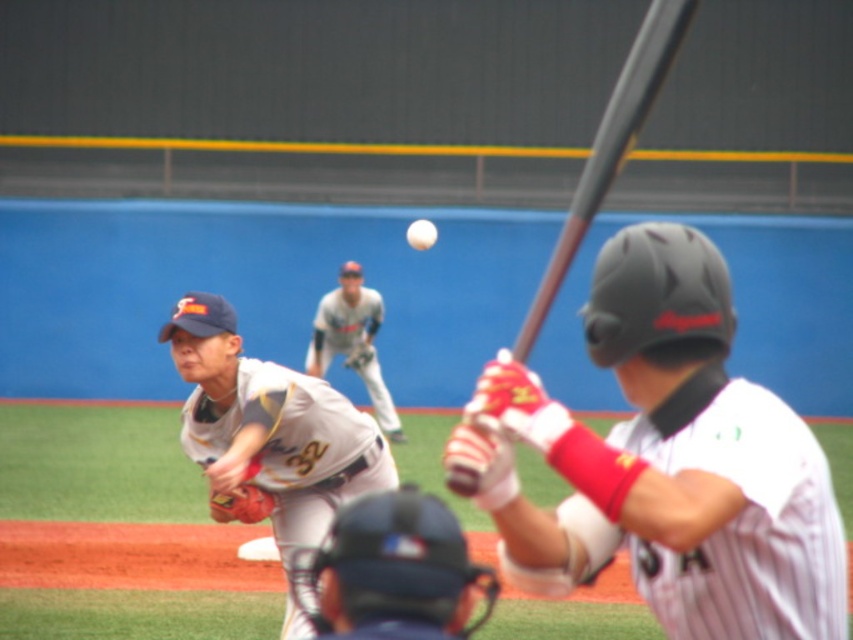
Based on the coordinates provided in the scene description, where exactly is the white matte baseball at center located?

The white matte baseball at center is located at point coordinates of (x=421, y=234).